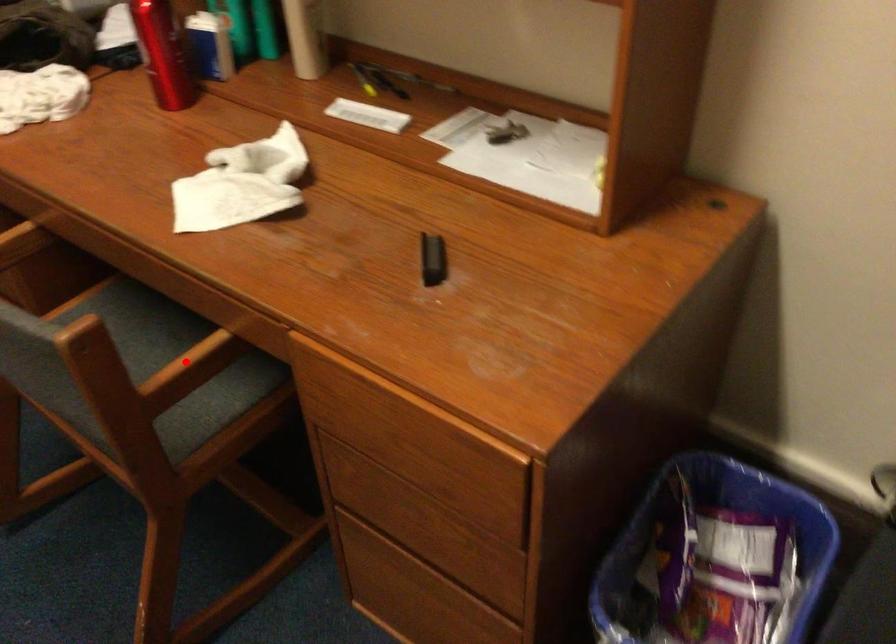
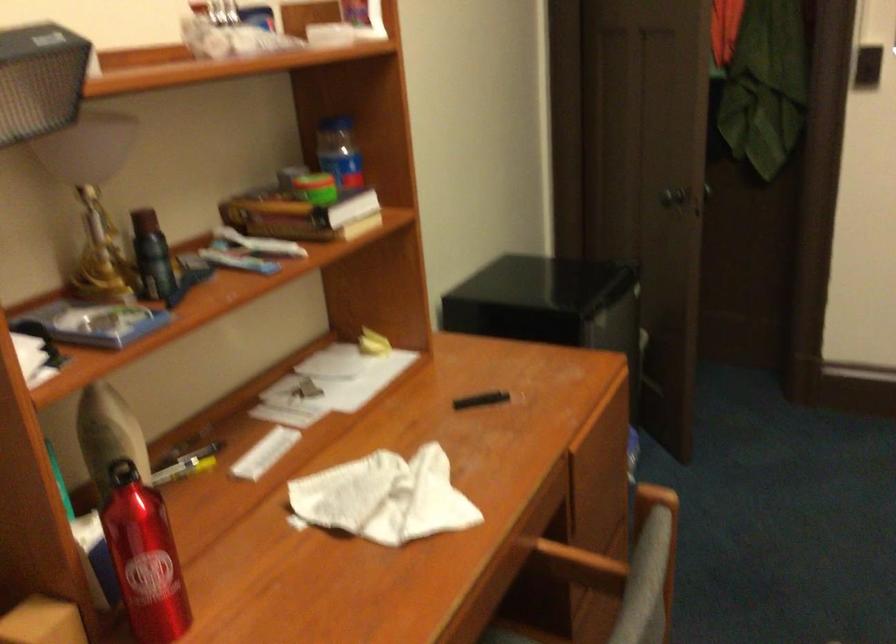
Question: I am providing you with two images of the same scene from different viewpoints. In image1, a red point is highlighted. Considering the same 3D point in image2, which of the following is correct?

Choices:
 (A) It is closer
 (B) It is farther

Answer: (B)